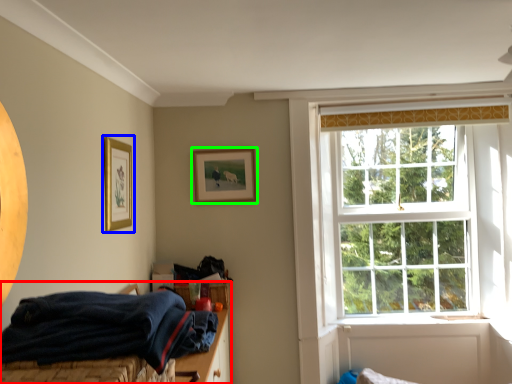
Question: Considering the real-world distances, which object is farthest from bed (highlighted by a red box)? picture frame (highlighted by a blue box) or picture frame (highlighted by a green box)?

Choices:
 (A) picture frame
 (B) picture frame

Answer: (A)